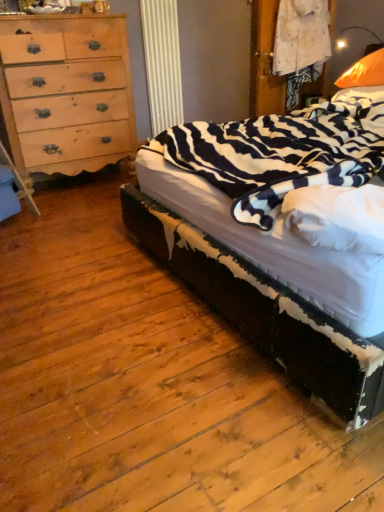
Question: Are orange fabric pillow at upper right and zebra-patterned fabric bed at right far apart?

Choices:
 (A) yes
 (B) no

Answer: (A)

Question: Considering the relative positions of orange fabric pillow at upper right and zebra-patterned fabric bed at right in the image provided, is orange fabric pillow at upper right to the right of zebra-patterned fabric bed at right from the viewer's perspective?

Choices:
 (A) no
 (B) yes

Answer: (B)

Question: Is orange fabric pillow at upper right turned away from zebra-patterned fabric bed at right?

Choices:
 (A) yes
 (B) no

Answer: (A)

Question: Is orange fabric pillow at upper right not within zebra-patterned fabric bed at right?

Choices:
 (A) no
 (B) yes

Answer: (A)

Question: Does orange fabric pillow at upper right appear on the left side of zebra-patterned fabric bed at right?

Choices:
 (A) no
 (B) yes

Answer: (A)

Question: From a real-world perspective, relative to orange fabric pillow at upper right, is light brown wood chest of drawers at left vertically above or below?

Choices:
 (A) above
 (B) below

Answer: (B)

Question: In terms of size, does light brown wood chest of drawers at left appear bigger or smaller than orange fabric pillow at upper right?

Choices:
 (A) big
 (B) small

Answer: (A)

Question: Is light brown wood chest of drawers at left situated inside orange fabric pillow at upper right or outside?

Choices:
 (A) inside
 (B) outside

Answer: (B)

Question: Looking at their shapes, would you say light brown wood chest of drawers at left is wider or thinner than orange fabric pillow at upper right?

Choices:
 (A) thin
 (B) wide

Answer: (B)

Question: Is zebra-patterned fabric bed at right taller or shorter than light brown wood chest of drawers at left?

Choices:
 (A) tall
 (B) short

Answer: (B)

Question: Is zebra-patterned fabric bed at right situated inside light brown wood chest of drawers at left or outside?

Choices:
 (A) outside
 (B) inside

Answer: (A)

Question: From a real-world perspective, is zebra-patterned fabric bed at right physically located above or below light brown wood chest of drawers at left?

Choices:
 (A) below
 (B) above

Answer: (A)

Question: In the image, is zebra-patterned fabric bed at right on the left side or the right side of light brown wood chest of drawers at left?

Choices:
 (A) right
 (B) left

Answer: (A)

Question: Relative to zebra-patterned fabric bed at right, is light brown wood chest of drawers at left in front or behind?

Choices:
 (A) behind
 (B) front

Answer: (A)

Question: From the image's perspective, is light brown wood chest of drawers at left above or below zebra-patterned fabric bed at right?

Choices:
 (A) above
 (B) below

Answer: (A)